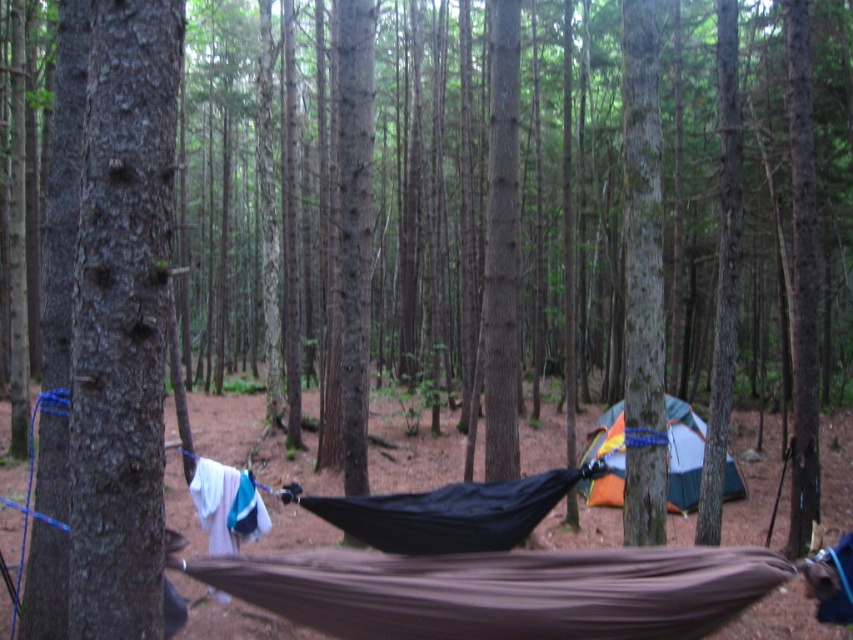
Who is taller, brown rough bark at left or green canvas tent at center?

Standing taller between the two is brown rough bark at left.

Between point (131, 129) and point (595, 424), which one is positioned behind?

Point (595, 424)

Between point (141, 625) and point (723, 481), which one is positioned behind?

The point (723, 481) is more distant.

The height and width of the screenshot is (640, 853). Identify the location of brown rough bark at left. (115, 337).